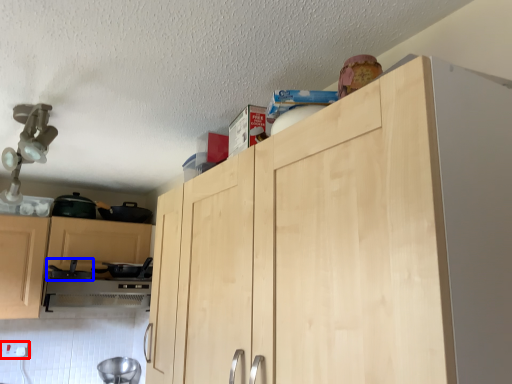
Question: Which object appears farthest to the camera in this image, electric outlet (highlighted by a red box) or appliance (highlighted by a blue box)?

Choices:
 (A) electric outlet
 (B) appliance

Answer: (A)